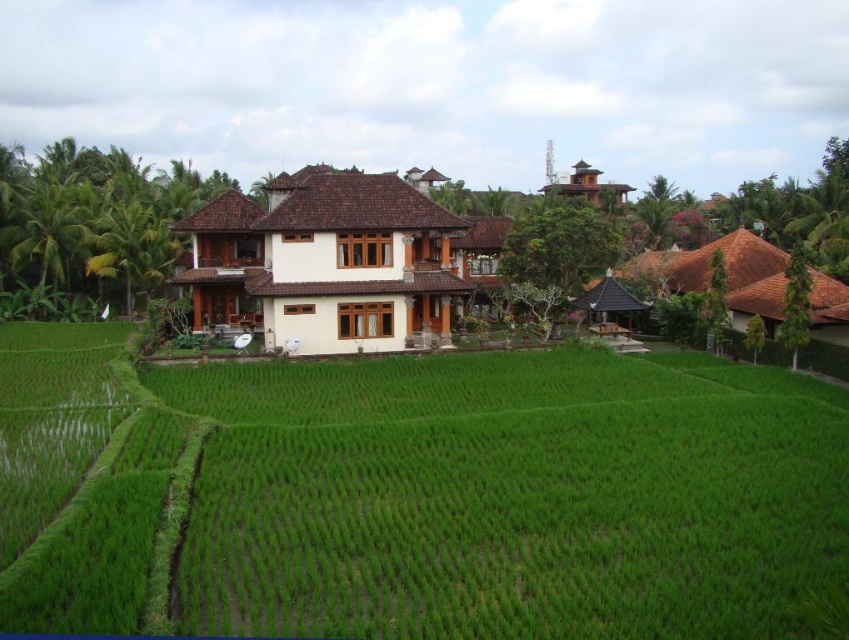
Question: Which point is farther to the camera?

Choices:
 (A) white wood house at center
 (B) wooden house at center
 (C) green grassy rice field at center

Answer: (B)

Question: Which is nearer to the brown wooden hut at upper right?

Choices:
 (A) wooden house at center
 (B) white wood house at center

Answer: (B)

Question: Does green grassy rice field at center have a smaller size compared to white wood house at center?

Choices:
 (A) no
 (B) yes

Answer: (B)

Question: Observing the image, what is the correct spatial positioning of green grassy rice field at center in reference to wooden house at center?

Choices:
 (A) right
 (B) left

Answer: (A)

Question: Does wooden house at center appear on the right side of brown wooden hut at upper right?

Choices:
 (A) yes
 (B) no

Answer: (B)

Question: Among these objects, which one is nearest to the camera?

Choices:
 (A) wooden house at center
 (B) white wood house at center
 (C) green grassy rice field at center

Answer: (C)